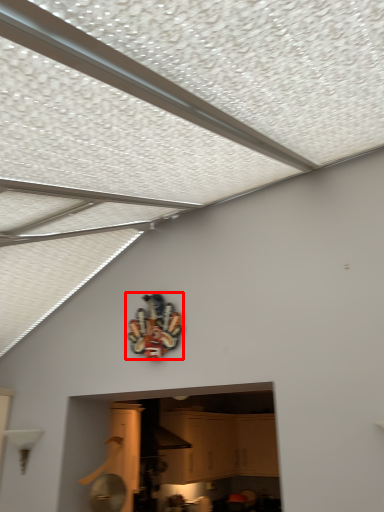
Question: From the image's perspective, where is design (annotated by the red box) located in relation to cabinetry in the image?

Choices:
 (A) below
 (B) above

Answer: (B)